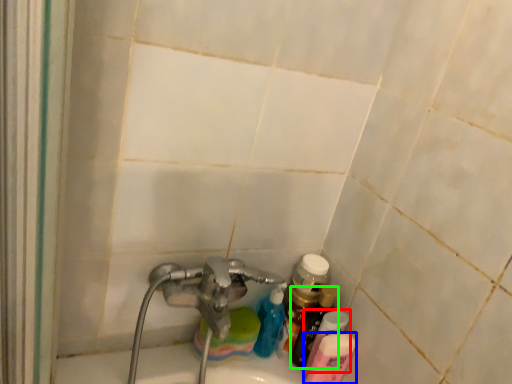
Question: Based on their relative distances, which object is farther from toiletry (highlighted by a red box)? Choose from toiletry (highlighted by a blue box) and bottle (highlighted by a green box).

Choices:
 (A) toiletry
 (B) bottle

Answer: (B)